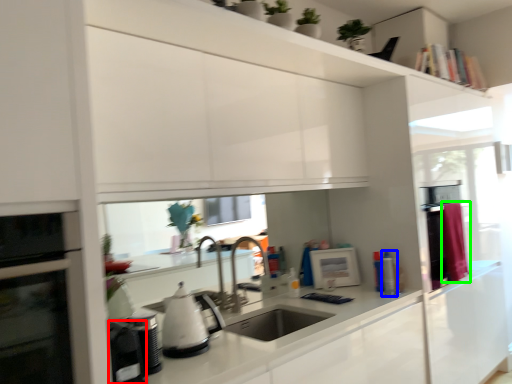
Question: Based on their relative distances, which object is nearer to appliance (highlighted by a red box)? Choose from appliance (highlighted by a blue box) and curtain (highlighted by a green box).

Choices:
 (A) appliance
 (B) curtain

Answer: (A)